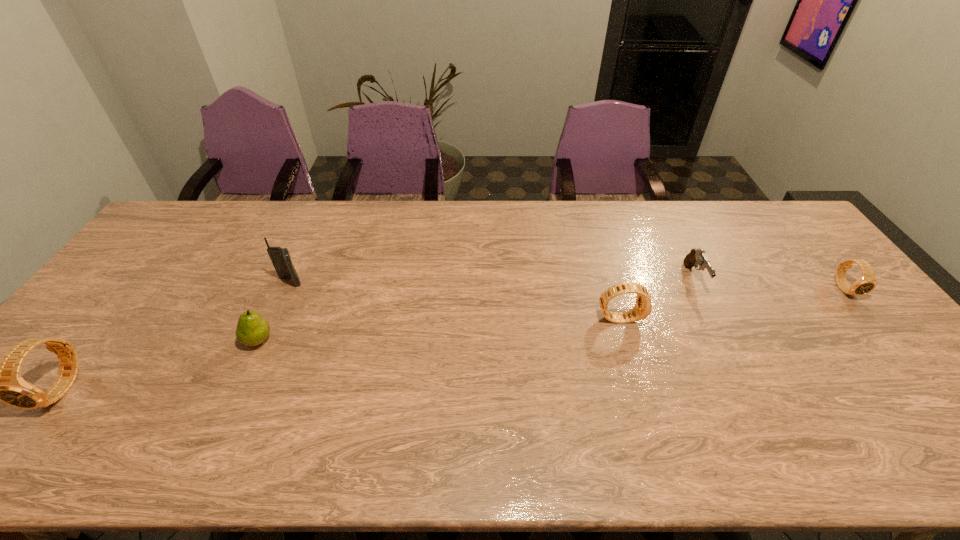
Where is `the leftmost object`? the leftmost object is located at coordinates (1, 381).

At what (x,y) coordinates should I click in order to perform the action: click on the nearest watch. Please return your answer as a coordinate pair (x, y). The height and width of the screenshot is (540, 960). Looking at the image, I should click on (1, 381).

Where is `the second shortest watch`? the second shortest watch is located at coordinates (643, 306).

Where is `the second watch from left to right`? Image resolution: width=960 pixels, height=540 pixels. the second watch from left to right is located at coordinates (643, 306).

Identify the location of the rightmost watch. (867, 282).

Identify the location of the shortest watch. (867, 282).

You are a GUI agent. You are given a task and a screenshot of the screen. Output one action in this format:
    pyautogui.click(x=<x>, y=<y>)
    Task: Click on the cellular telephone
    Image resolution: width=960 pixels, height=540 pixels.
    Given the screenshot: What is the action you would take?
    pyautogui.click(x=280, y=257)

Locate an element on the screen. The image size is (960, 540). the fifth object from left to right is located at coordinates (696, 257).

This screenshot has width=960, height=540. I want to click on pear, so click(252, 329).

In order to click on blank space located 0.210m on the face of the second watch from right to left in this screenshot , I will do `click(717, 318)`.